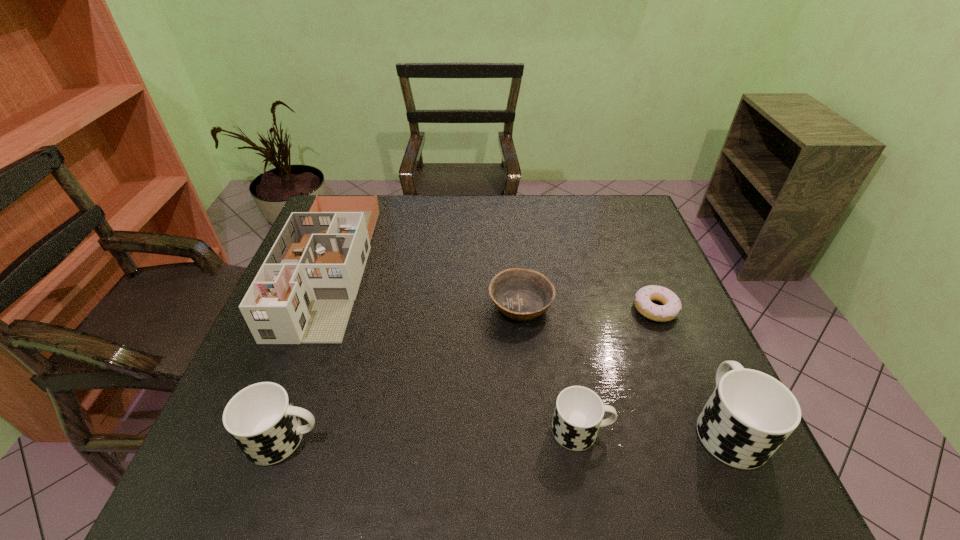
The height and width of the screenshot is (540, 960). In order to click on free space between the rightmost cup and the third shortest object in this screenshot , I will do `click(654, 428)`.

Identify the location of vacant area between the second tallest cup and the tallest cup. The image size is (960, 540). (505, 433).

In order to click on vacant space that is in between the shortest object and the second tallest cup in this screenshot , I will do `click(469, 374)`.

This screenshot has width=960, height=540. Identify the location of free space between the shortest object and the tallest cup. (691, 368).

Point out which object is positioned as the second nearest to the fourth tallest object. Please provide its 2D coordinates. Your answer should be formatted as a tuple, i.e. [(x, y)], where the tuple contains the x and y coordinates of a point satisfying the conditions above.

[(520, 294)]

Select which object is the second closest to the leftmost cup. Please provide its 2D coordinates. Your answer should be formatted as a tuple, i.e. [(x, y)], where the tuple contains the x and y coordinates of a point satisfying the conditions above.

[(520, 294)]

Find the location of a particular element. This screenshot has height=540, width=960. the closest cup to the shortest object is located at coordinates (749, 415).

Select which cup is the closest to the leftmost cup. Please provide its 2D coordinates. Your answer should be formatted as a tuple, i.e. [(x, y)], where the tuple contains the x and y coordinates of a point satisfying the conditions above.

[(579, 411)]

You are a GUI agent. You are given a task and a screenshot of the screen. Output one action in this format:
    pyautogui.click(x=<x>, y=<y>)
    Task: Click on the free spot that satisfies the following two spatial constraints: 1. at the entrance of the dollhouse; 2. on the left side of the shortest object
    Image resolution: width=960 pixels, height=540 pixels.
    Given the screenshot: What is the action you would take?
    pyautogui.click(x=313, y=309)

Find the location of a particular element. Image resolution: width=960 pixels, height=540 pixels. vacant area that satisfies the following two spatial constraints: 1. at the entrance of the dollhouse; 2. on the left side of the bowl is located at coordinates (315, 306).